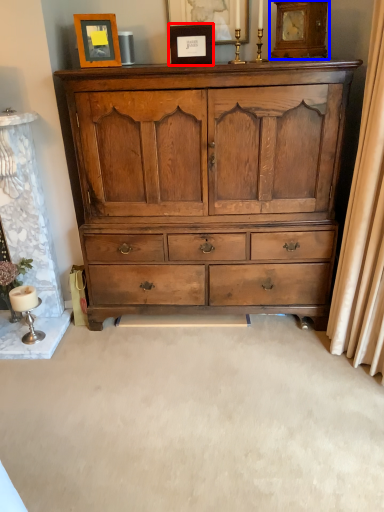
Question: Which object is further to the camera taking this photo, picture frame (highlighted by a red box) or clock (highlighted by a blue box)?

Choices:
 (A) picture frame
 (B) clock

Answer: (A)